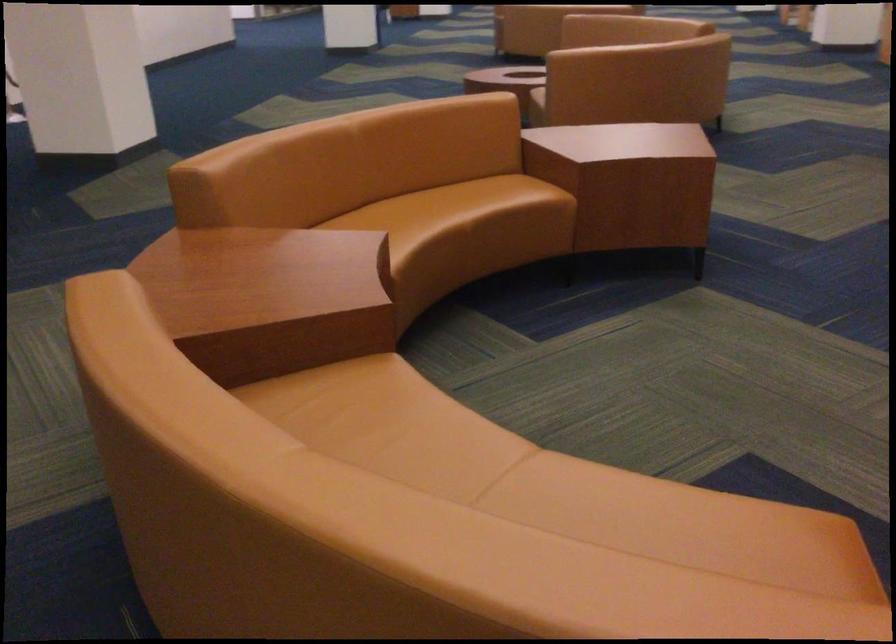
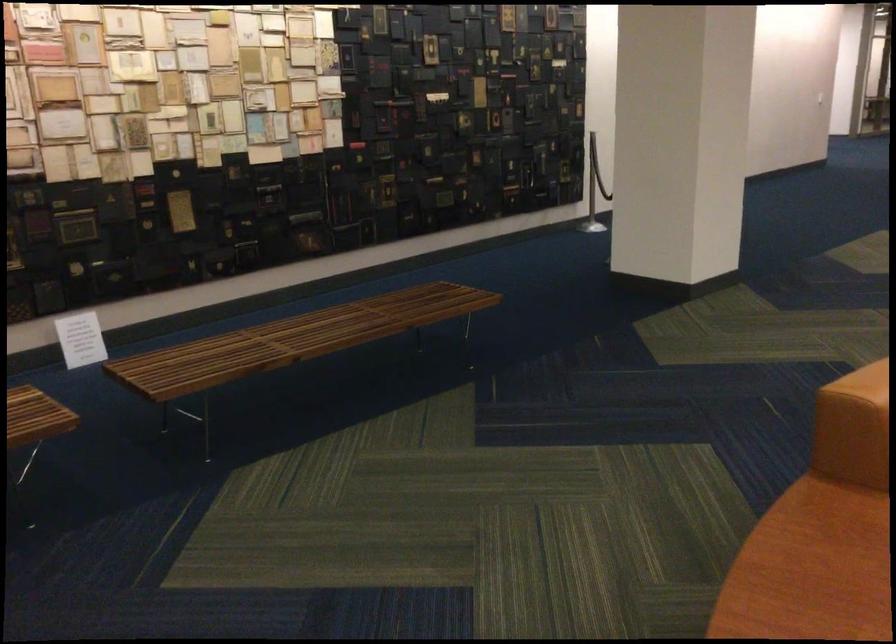
Question: The first image is from the beginning of the video and the second image is from the end. How did the camera likely rotate when shooting the video?

Choices:
 (A) Left
 (B) Right
 (C) Up
 (D) Down

Answer: (A)